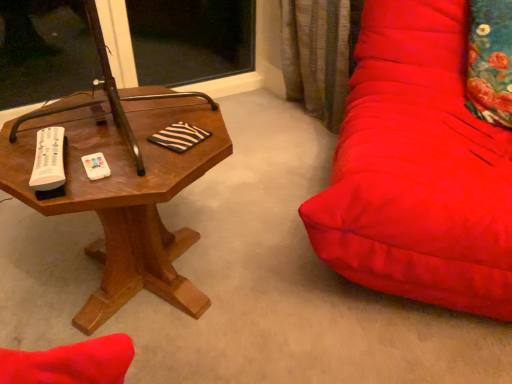
The width and height of the screenshot is (512, 384). In order to click on free spot to the right of woodenobject at left in this screenshot , I will do `click(293, 286)`.